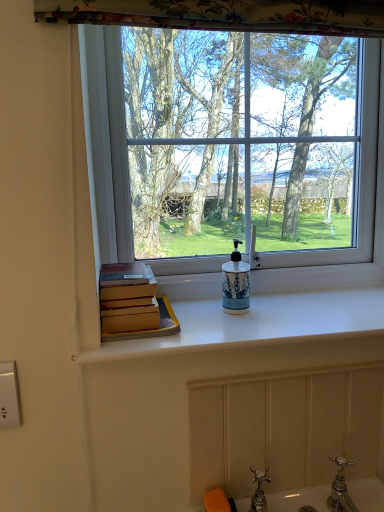
Question: Considering the relative sizes of blue and white ceramic soap dispenser at center and transparent glass window at center in the image provided, is blue and white ceramic soap dispenser at center thinner than transparent glass window at center?

Choices:
 (A) yes
 (B) no

Answer: (A)

Question: Can you confirm if blue and white ceramic soap dispenser at center is taller than transparent glass window at center?

Choices:
 (A) no
 (B) yes

Answer: (A)

Question: Does blue and white ceramic soap dispenser at center come behind transparent glass window at center?

Choices:
 (A) yes
 (B) no

Answer: (B)

Question: Is transparent glass window at center inside blue and white ceramic soap dispenser at center?

Choices:
 (A) yes
 (B) no

Answer: (B)

Question: Is blue and white ceramic soap dispenser at center placed right next to transparent glass window at center?

Choices:
 (A) yes
 (B) no

Answer: (B)

Question: Is blue and white ceramic soap dispenser at center positioned beyond the bounds of transparent glass window at center?

Choices:
 (A) yes
 (B) no

Answer: (A)

Question: From the image's perspective, is white glossy counter top at center over white plastic electric outlet at lower left?

Choices:
 (A) no
 (B) yes

Answer: (B)

Question: Can you confirm if white glossy counter top at center is positioned to the right of white plastic electric outlet at lower left?

Choices:
 (A) no
 (B) yes

Answer: (B)

Question: Is white glossy counter top at center next to white plastic electric outlet at lower left and touching it?

Choices:
 (A) no
 (B) yes

Answer: (A)

Question: Does white glossy counter top at center have a greater width compared to white plastic electric outlet at lower left?

Choices:
 (A) yes
 (B) no

Answer: (A)

Question: Is white glossy counter top at center further to the viewer compared to white plastic electric outlet at lower left?

Choices:
 (A) yes
 (B) no

Answer: (A)

Question: Considering the relative sizes of white glossy counter top at center and white plastic electric outlet at lower left in the image provided, is white glossy counter top at center shorter than white plastic electric outlet at lower left?

Choices:
 (A) no
 (B) yes

Answer: (B)

Question: From the image's perspective, is blue and white ceramic soap dispenser at center located beneath white glossy counter top at center?

Choices:
 (A) yes
 (B) no

Answer: (B)